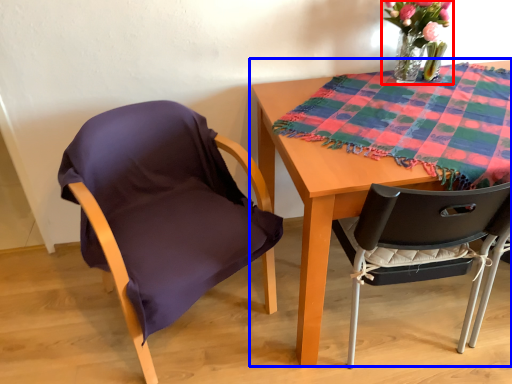
Question: Which of the following is the closest to the observer, floral arrangement (highlighted by a red box) or table (highlighted by a blue box)?

Choices:
 (A) floral arrangement
 (B) table

Answer: (B)